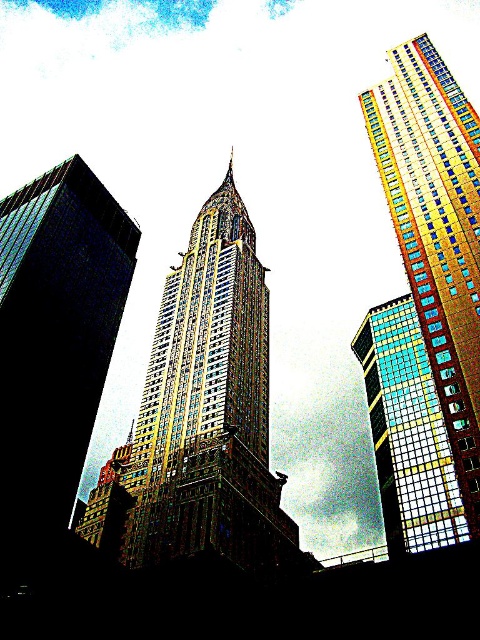
Question: Is gold glass skyscraper at center below multicolored glass skyscraper at center?

Choices:
 (A) no
 (B) yes

Answer: (B)

Question: Which of the following is the farthest from the observer?

Choices:
 (A) gold mosaic skyscraper at right
 (B) multicolored glass skyscraper at center
 (C) gold glass skyscraper at center

Answer: (C)

Question: In this image, where is gold glass skyscraper at center located relative to multicolored glass skyscraper at center?

Choices:
 (A) above
 (B) below

Answer: (B)

Question: Observing the image, what is the correct spatial positioning of gold mosaic skyscraper at right in reference to multicolored glass skyscraper at center?

Choices:
 (A) below
 (B) above

Answer: (B)

Question: Which point is closer to the camera?

Choices:
 (A) gold mosaic skyscraper at right
 (B) multicolored glass skyscraper at center

Answer: (A)

Question: Which object appears closest to the camera in this image?

Choices:
 (A) gold mosaic skyscraper at right
 (B) gold glass skyscraper at center
 (C) multicolored glass skyscraper at center

Answer: (A)